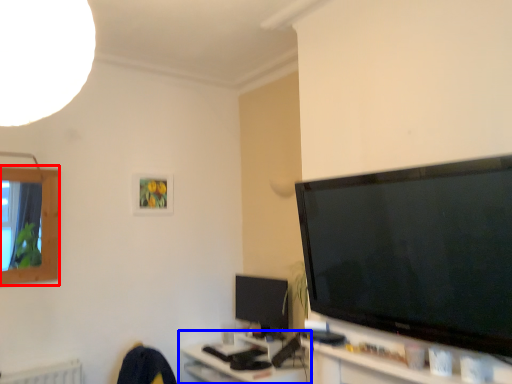
Question: Which object appears farthest to the camera in this image, window (highlighted by a red box) or computer (highlighted by a blue box)?

Choices:
 (A) window
 (B) computer

Answer: (A)